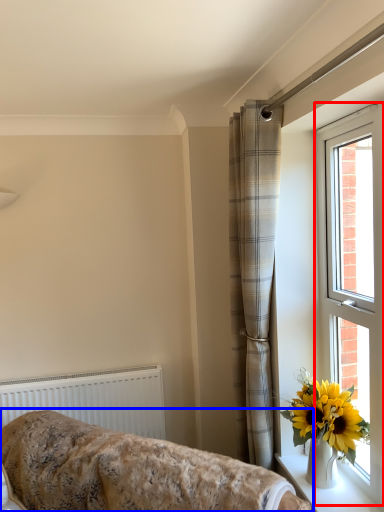
Question: Which point is further to the camera, window (highlighted by a red box) or furniture (highlighted by a blue box)?

Choices:
 (A) window
 (B) furniture

Answer: (A)